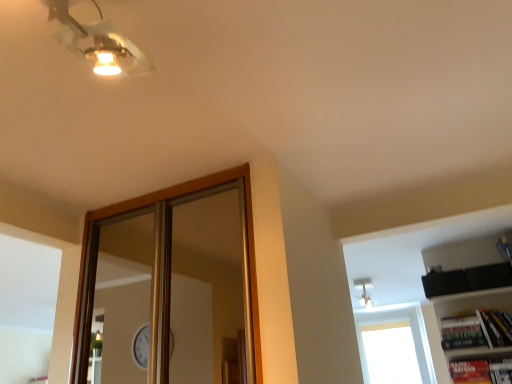
Question: From the image's perspective, relative to white glass window at upper right, is metallic gold ceiling light at upper left above or below?

Choices:
 (A) above
 (B) below

Answer: (A)

Question: Considering the positions of metallic gold ceiling light at upper left and white glass window at upper right in the image, is metallic gold ceiling light at upper left taller or shorter than white glass window at upper right?

Choices:
 (A) short
 (B) tall

Answer: (A)

Question: Is metallic gold ceiling light at upper left bigger or smaller than white glass window at upper right?

Choices:
 (A) big
 (B) small

Answer: (B)

Question: Is white glass window at upper right situated inside metallic gold ceiling light at upper left or outside?

Choices:
 (A) inside
 (B) outside

Answer: (B)

Question: From the image's perspective, relative to metallic gold ceiling light at upper left, is white glass window at upper right above or below?

Choices:
 (A) above
 (B) below

Answer: (B)

Question: In terms of width, does white glass window at upper right look wider or thinner when compared to metallic gold ceiling light at upper left?

Choices:
 (A) wide
 (B) thin

Answer: (A)

Question: In the image, is white glass window at upper right positioned in front of or behind metallic gold ceiling light at upper left?

Choices:
 (A) behind
 (B) front

Answer: (A)